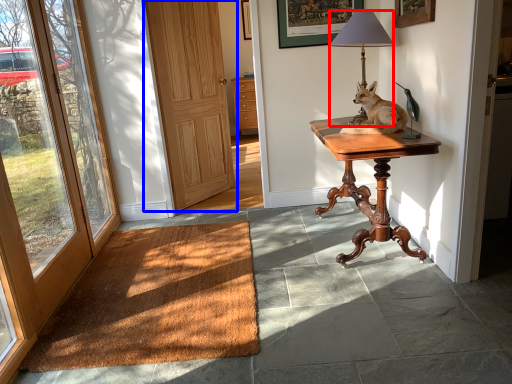
Question: Which point is further to the camera, lamp (highlighted by a red box) or door (highlighted by a blue box)?

Choices:
 (A) lamp
 (B) door

Answer: (B)